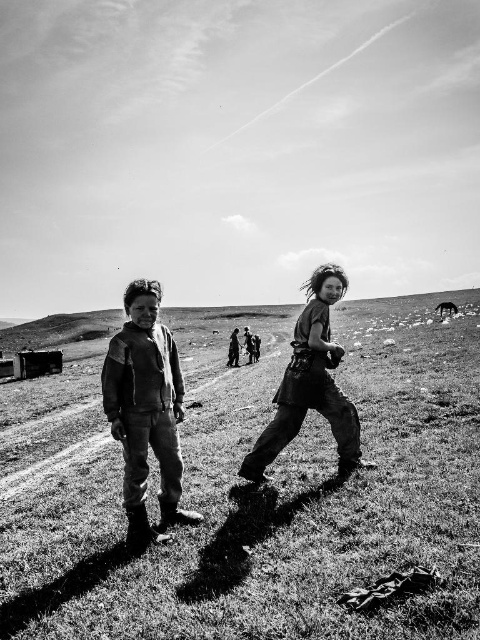
Question: Which of the following is the closest to the observer?

Choices:
 (A) rugged leather jacket at center
 (B) leather jacket at center

Answer: (B)

Question: Is grass at center below rugged leather jacket at center?

Choices:
 (A) yes
 (B) no

Answer: (B)

Question: From the image, what is the correct spatial relationship of leather jacket at center in relation to rugged leather jacket at center?

Choices:
 (A) above
 (B) below

Answer: (A)

Question: Is leather jacket at center to the left of rugged leather jacket at center from the viewer's perspective?

Choices:
 (A) no
 (B) yes

Answer: (B)

Question: Which point is farther to the camera?

Choices:
 (A) (468, 611)
 (B) (149, 323)

Answer: (B)

Question: Which point appears farthest from the camera in this image?

Choices:
 (A) (157, 401)
 (B) (346, 289)
 (C) (313, 490)

Answer: (B)